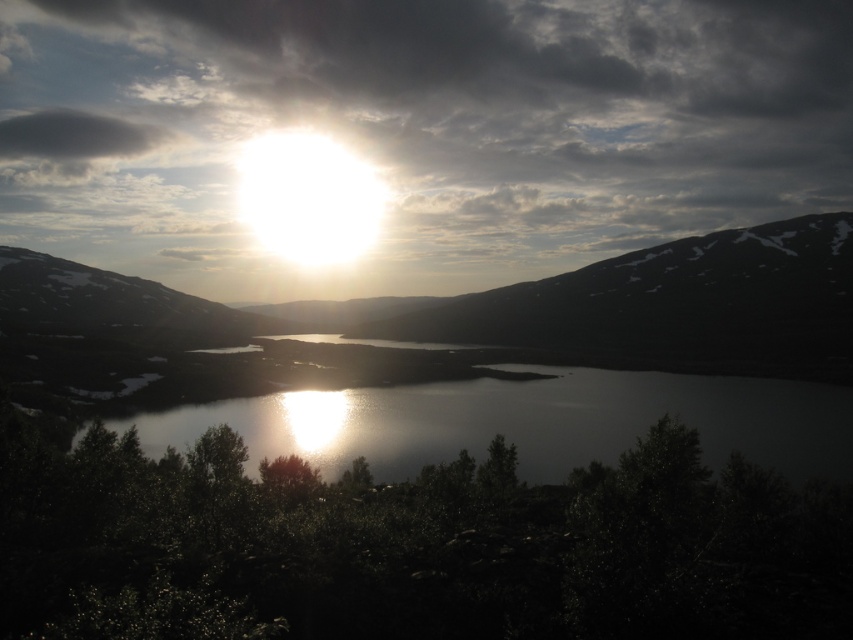
Question: Where is dark gray rocky mountain at center located in relation to glistening reflective water at center in the image?

Choices:
 (A) right
 (B) left

Answer: (B)

Question: Is dark gray rocky mountain at center above glistening reflective water at center?

Choices:
 (A) yes
 (B) no

Answer: (A)

Question: Which point is closer to the camera?

Choices:
 (A) (816, 284)
 (B) (747, 428)

Answer: (B)

Question: Among these points, which one is farthest from the camera?

Choices:
 (A) 753,412
 (B) 572,294

Answer: (B)

Question: Does dark gray rocky mountain at center appear on the left side of glistening reflective water at center?

Choices:
 (A) no
 (B) yes

Answer: (B)